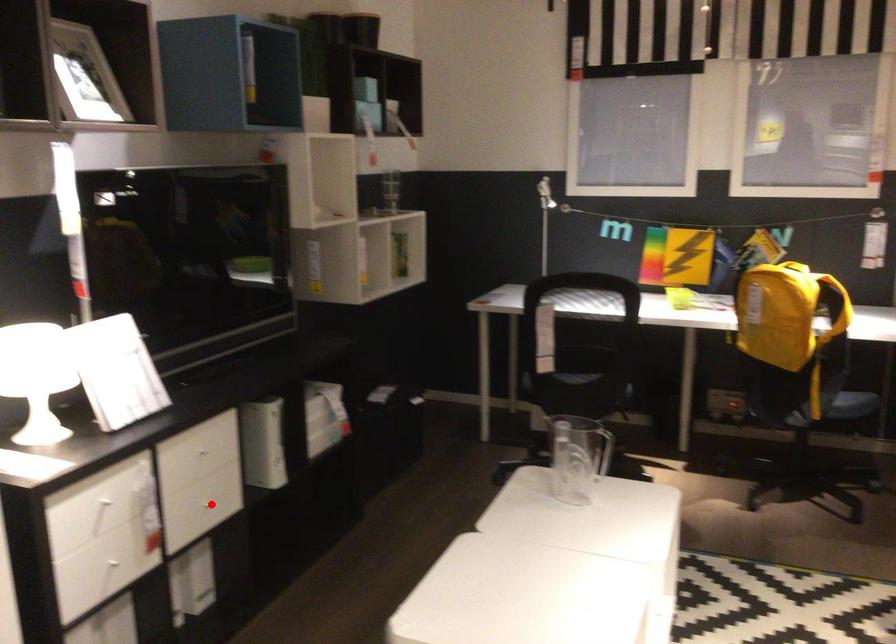
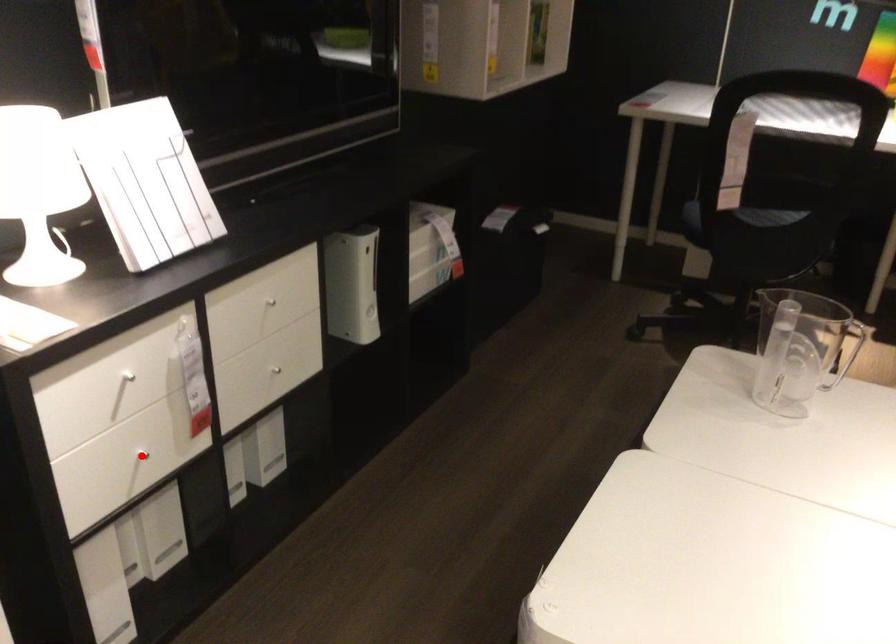
I am providing you with two images of the same scene from different viewpoints. A red point is marked on the first image and another point is marked on the second image. Is the marked point in image1 the same physical position as the marked point in image2?

No